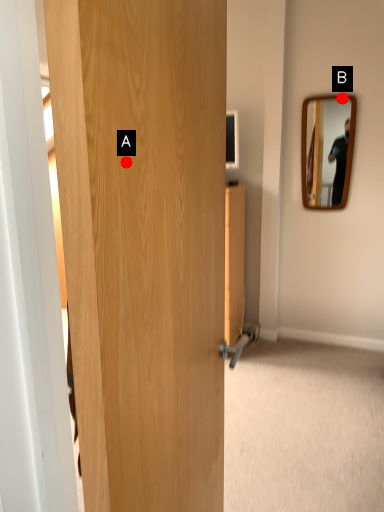
Question: Two points are circled on the image, labeled by A and B beside each circle. Which point appears closest to the camera in this image?

Choices:
 (A) A is closer
 (B) B is closer

Answer: (A)